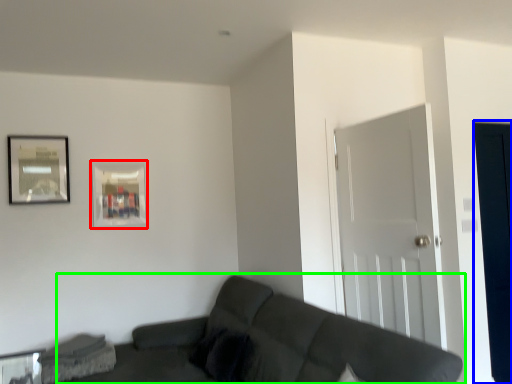
Question: Which object is positioned closest to picture frame (highlighted by a red box)? Select from glass door (highlighted by a blue box) and studio couch (highlighted by a green box).

Choices:
 (A) glass door
 (B) studio couch

Answer: (B)